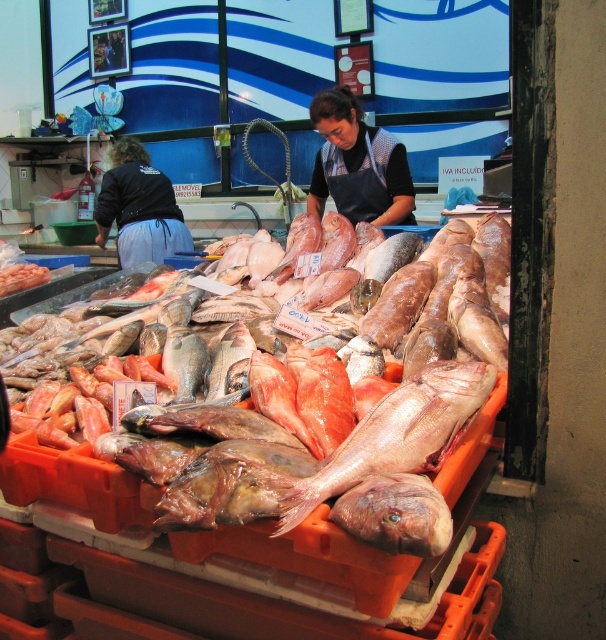
Please look at the image and locate the black apron at center. What are its coordinates in the scene?

The coordinates of the black apron at center are at point (358, 164).

You are a customer at the seafood market and want to buy the pink glossy fish at center. The fish is located at point coordinates of (x=398, y=433). If you walk towards the fish, will you first pass the display of fresh fish on orange plastic crates in the foreground or the two individuals working behind the counter in the background?

The point coordinates indicate the pink glossy fish at center is located at the foreground display since the display of fresh fish on orange plastic crates is in the foreground. Therefore, when approaching the fish, you would first pass the display of fresh fish on orange plastic crates in the foreground before reaching the fish itself. However, the two individuals are in the background, so they are behind the display. Thus, you would first encounter the display of fresh fish on orange plastic crates in the

You are standing at the entrance of the seafood market and want to reach the counter where the person in the black shirt is working. The counter is located at point (427, 429). If you can move forward 1.2 meters, will you be able to reach the counter?

The distance between you and the counter at point (427, 429) is 1.19 meters. Since you can move forward 1.2 meters, you will be able to reach the counter.